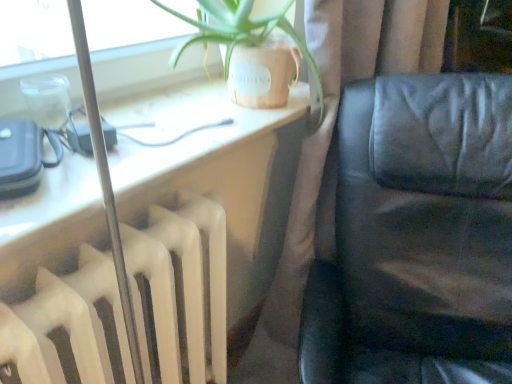
Question: Does brown fabric curtain at center have a smaller size compared to matte black leather couch at right?

Choices:
 (A) no
 (B) yes

Answer: (A)

Question: Is matte black leather couch at right surrounded by brown fabric curtain at center?

Choices:
 (A) yes
 (B) no

Answer: (B)

Question: Is brown fabric curtain at center far away from matte black leather couch at right?

Choices:
 (A) yes
 (B) no

Answer: (B)

Question: Is brown fabric curtain at center next to matte black leather couch at right and touching it?

Choices:
 (A) yes
 (B) no

Answer: (B)

Question: Can you confirm if brown fabric curtain at center is bigger than matte black leather couch at right?

Choices:
 (A) no
 (B) yes

Answer: (B)

Question: Is white matte radiator at left taller or shorter than matte black leather couch at right?

Choices:
 (A) short
 (B) tall

Answer: (A)

Question: Would you say white matte radiator at left is to the left or to the right of matte black leather couch at right in the picture?

Choices:
 (A) left
 (B) right

Answer: (A)

Question: Which is correct: white matte radiator at left is inside matte black leather couch at right, or outside of it?

Choices:
 (A) inside
 (B) outside

Answer: (A)

Question: From the image's perspective, is white matte radiator at left located above or below matte black leather couch at right?

Choices:
 (A) above
 (B) below

Answer: (B)

Question: Is point pos(301,296) positioned closer to the camera than point pos(384,89)?

Choices:
 (A) farther
 (B) closer

Answer: (A)

Question: Relative to black leather couch at right, is brown fabric curtain at center in front or behind?

Choices:
 (A) front
 (B) behind

Answer: (B)

Question: Is brown fabric curtain at center wider or thinner than black leather couch at right?

Choices:
 (A) thin
 (B) wide

Answer: (A)

Question: Based on their sizes in the image, would you say brown fabric curtain at center is bigger or smaller than black leather couch at right?

Choices:
 (A) big
 (B) small

Answer: (B)

Question: Considering their positions, is black leather couch at right located in front of or behind brown fabric curtain at center?

Choices:
 (A) front
 (B) behind

Answer: (A)

Question: From the image's perspective, is black leather couch at right positioned above or below brown fabric curtain at center?

Choices:
 (A) above
 (B) below

Answer: (B)